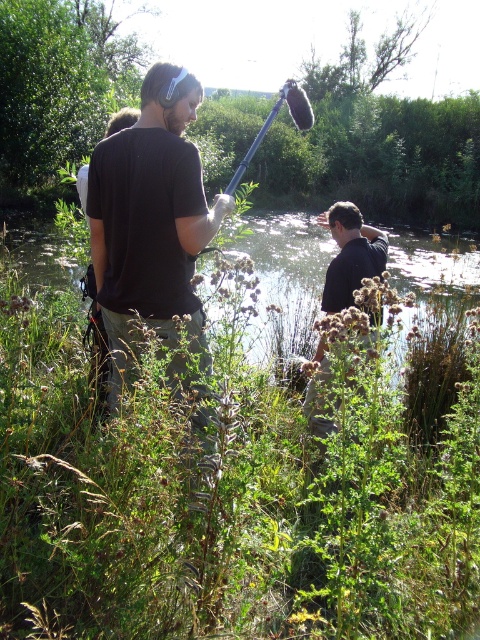
Question: Estimate the real-world distances between objects in this image. Which object is farther from the clear water at center?

Choices:
 (A) black matte shirt at left
 (B) black matte shirt at center

Answer: (B)

Question: Can you confirm if clear water at center is smaller than black matte shirt at center?

Choices:
 (A) yes
 (B) no

Answer: (B)

Question: Is black matte shirt at left to the right of clear water at center from the viewer's perspective?

Choices:
 (A) no
 (B) yes

Answer: (A)

Question: Is clear water at center wider than black matte shirt at center?

Choices:
 (A) yes
 (B) no

Answer: (A)

Question: Which of these objects is positioned closest to the black matte shirt at left?

Choices:
 (A) black matte shirt at center
 (B) clear water at center

Answer: (A)

Question: Which object is farther from the camera taking this photo?

Choices:
 (A) clear water at center
 (B) black matte shirt at left
 (C) black matte shirt at center

Answer: (C)